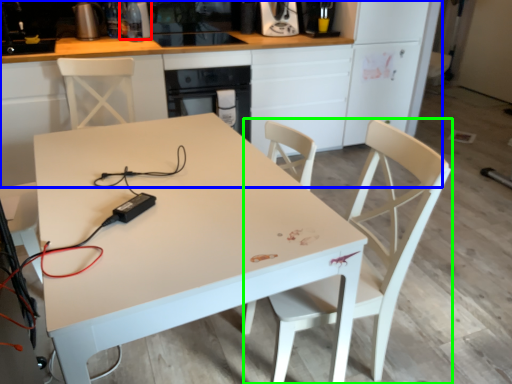
Question: Which object is positioned farthest from appliance (highlighted by a red box)? Select from cabinetry (highlighted by a blue box) and chair (highlighted by a green box).

Choices:
 (A) cabinetry
 (B) chair

Answer: (B)